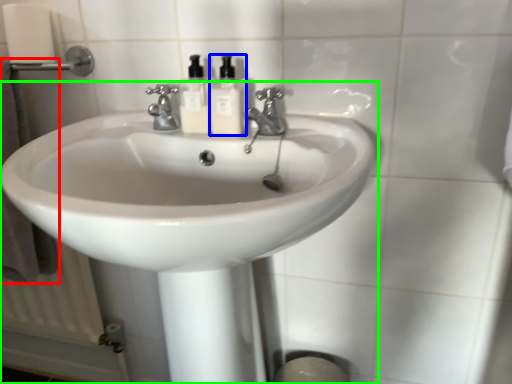
Question: Considering the real-world distances, which object is closest to bath towel (highlighted by a red box)? soap dispenser (highlighted by a blue box) or sink (highlighted by a green box).

Choices:
 (A) soap dispenser
 (B) sink

Answer: (B)